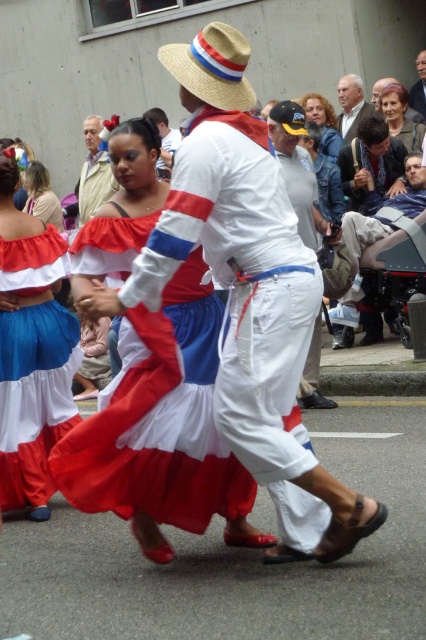
Does white cotton pants at center appear on the left side of white cotton hat at upper center?

Incorrect, white cotton pants at center is not on the left side of white cotton hat at upper center.

This screenshot has width=426, height=640. What do you see at coordinates (298, 172) in the screenshot?
I see `white cotton pants at center` at bounding box center [298, 172].

Measure the distance between point (336, 228) and camera.

Point (336, 228) and camera are 22.83 feet apart from each other.

The width and height of the screenshot is (426, 640). I want to click on white cotton pants at center, so click(x=298, y=172).

Who is positioned more to the left, matte red skirt at center or white cotton pants at center?

matte red skirt at center

Which of these two, matte red skirt at center or white cotton pants at center, stands taller?

With more height is matte red skirt at center.

Which is in front, point (39, 384) or point (293, 163)?

Point (39, 384)

At what (x,y) coordinates should I click in order to perform the action: click on matte red skirt at center. Please return your answer as a coordinate pair (x, y). Image resolution: width=426 pixels, height=640 pixels. Looking at the image, I should click on (31, 353).

Which is more to the left, matte blue jacket at upper center or white cotton hat at upper center?

Positioned to the left is white cotton hat at upper center.

Does matte blue jacket at upper center lie behind white cotton hat at upper center?

That is False.

Locate an element on the screen. matte blue jacket at upper center is located at coordinates (322, 122).